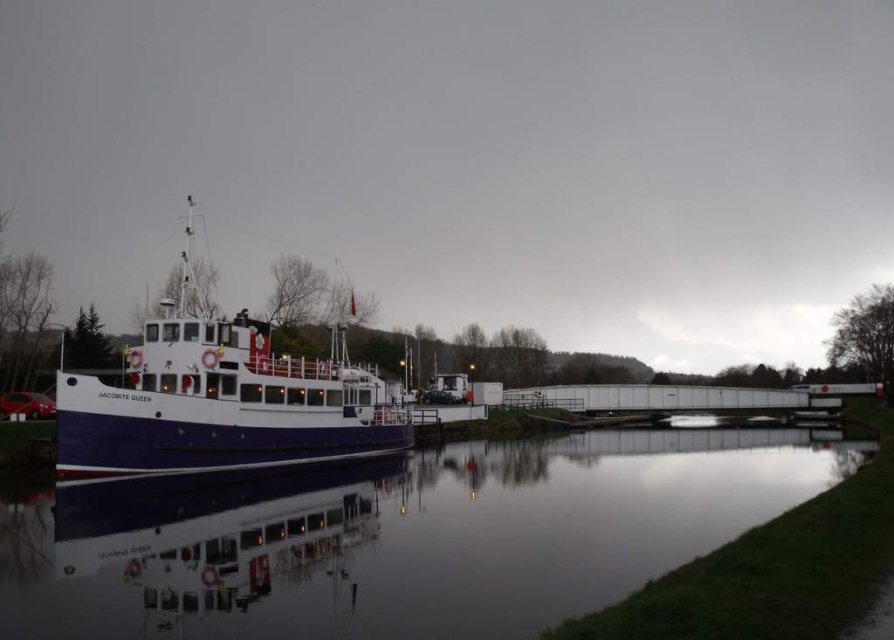
Between smooth water at lower center and white glossy boat at left, which one has more height?

Standing taller between the two is white glossy boat at left.

Where is `smooth water at lower center`? smooth water at lower center is located at coordinates (410, 540).

Locate an element on the screen. smooth water at lower center is located at coordinates (410, 540).